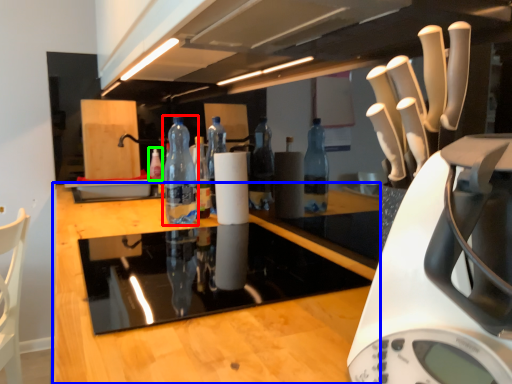
Question: Which is nearer to the bottle (highlighted by a red box)? countertop (highlighted by a blue box) or bottle (highlighted by a green box).

Choices:
 (A) countertop
 (B) bottle

Answer: (A)